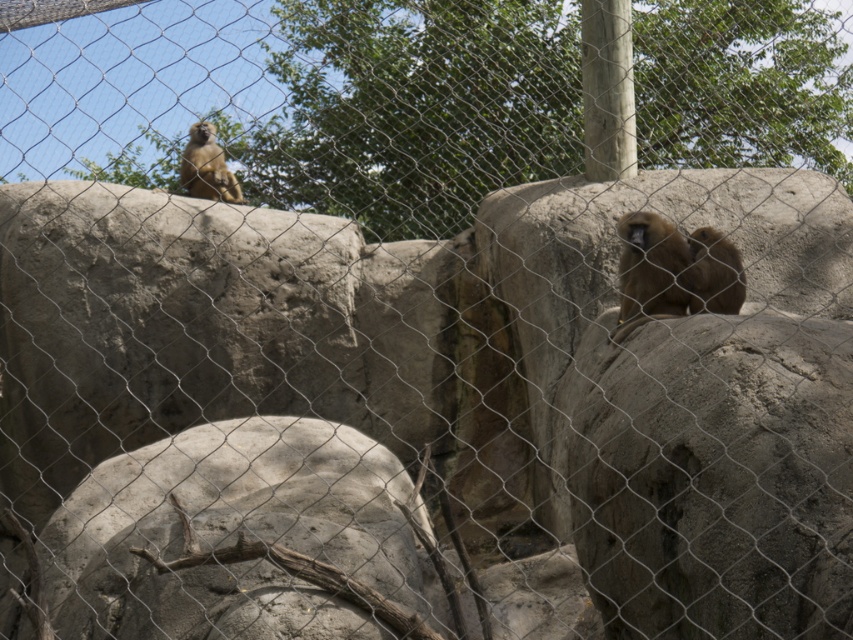
You are a zookeeper standing at the front of the enclosure. You need to throw a banana to the brown furry monkey at right. The banana can travel 10 meters. Will it reach the monkey?

The brown furry monkey at right is 8.83 meters from viewer. Since the banana can travel 10 meters, it will reach the monkey.

Consider the image. You are a zookeeper trying to feed the brown furry monkey at right and the brown furry monkey at upper left. Since you can only reach one at a time, which monkey would you need to approach first if you want to feed the one closer to the right side of the enclosure?

The brown furry monkey at right is positioned on the right side of the brown furry monkey at upper left, so you should approach the brown furry monkey at right first since it is already on the right side of the enclosure.